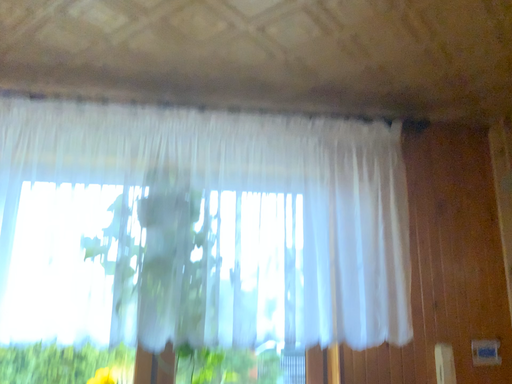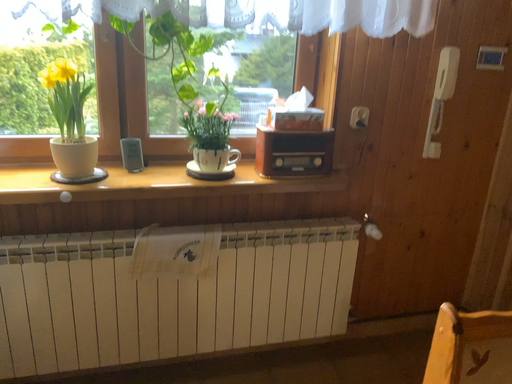
Question: How did the camera likely rotate when shooting the video?

Choices:
 (A) rotated right
 (B) rotated left

Answer: (A)